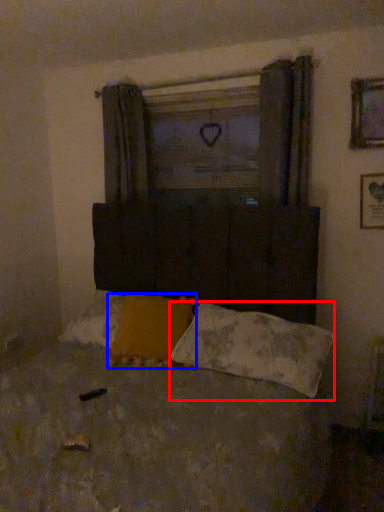
Question: Which point is closer to the camera, pillow (highlighted by a red box) or pillow (highlighted by a blue box)?

Choices:
 (A) pillow
 (B) pillow

Answer: (A)